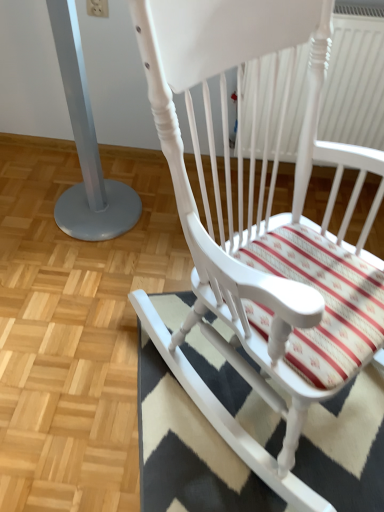
Find the location of a particular element. The height and width of the screenshot is (512, 384). vacant space in silver metallic pole at left (from a real-world perspective) is located at coordinates (107, 210).